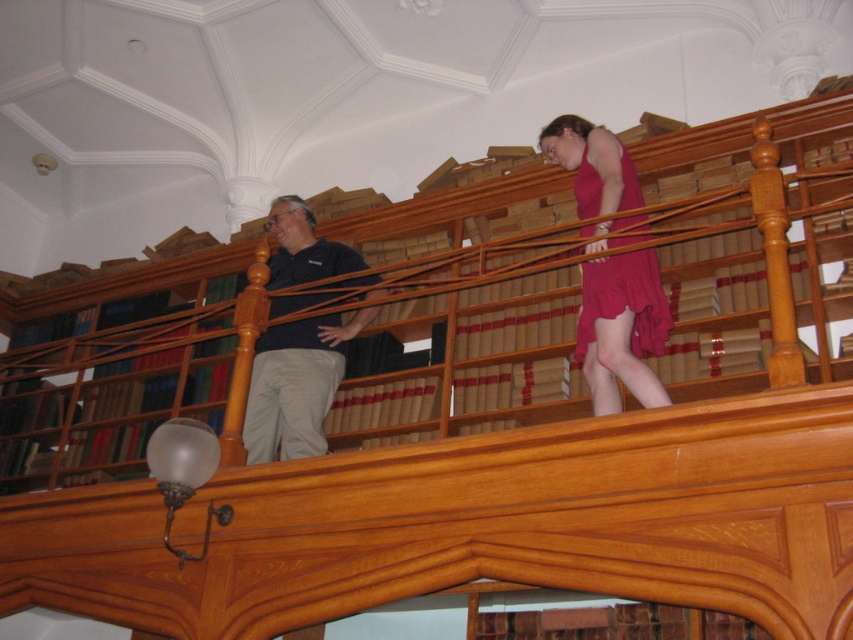
Question: Which point is farther to the camera?

Choices:
 (A) brown wood bookcase at upper center
 (B) matte red dress at center
 (C) black matte shirt at center

Answer: (A)

Question: Is brown wood bookcase at upper center positioned at the back of black matte shirt at center?

Choices:
 (A) no
 (B) yes

Answer: (B)

Question: Is black matte shirt at center smaller than matte red dress at center?

Choices:
 (A) no
 (B) yes

Answer: (A)

Question: Which object is closer to the camera taking this photo?

Choices:
 (A) matte red dress at center
 (B) brown wood bookcase at upper center
 (C) black matte shirt at center

Answer: (A)

Question: Is brown wood bookcase at upper center positioned at the back of black matte shirt at center?

Choices:
 (A) yes
 (B) no

Answer: (A)

Question: Which object appears farthest from the camera in this image?

Choices:
 (A) brown wood bookcase at upper center
 (B) black matte shirt at center
 (C) matte red dress at center

Answer: (A)